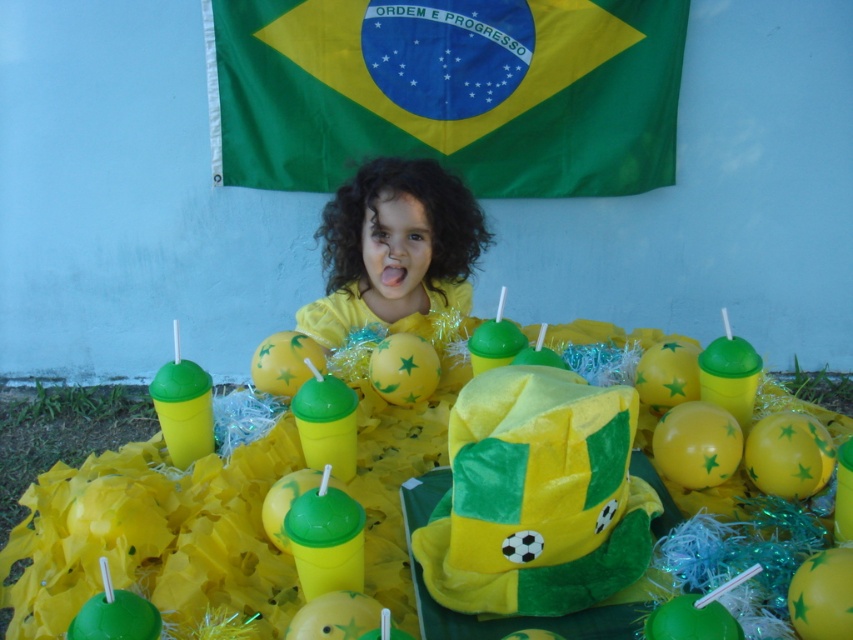
Question: Can you confirm if green fabric flag at upper center is positioned below yellow matte shirt at center?

Choices:
 (A) no
 (B) yes

Answer: (A)

Question: Among these points, which one is nearest to the camera?

Choices:
 (A) (358, 320)
 (B) (425, 64)

Answer: (A)

Question: Can you confirm if green fabric flag at upper center is thinner than yellow matte shirt at center?

Choices:
 (A) yes
 (B) no

Answer: (B)

Question: Is green fabric flag at upper center above yellow matte shirt at center?

Choices:
 (A) yes
 (B) no

Answer: (A)